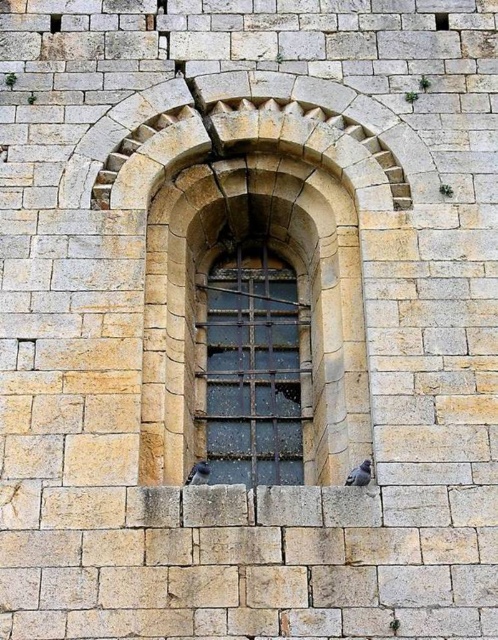
Between point (352, 474) and point (200, 470), which one is positioned in front?

Point (200, 470) is in front.

Is gray matte pigeon at lower right behind gray matte pigeon at lower center?

No, it is in front of gray matte pigeon at lower center.

Find the location of a particular element. gray matte pigeon at lower right is located at coordinates (360, 474).

Between dark glass window at center and gray matte pigeon at lower center, which one has more height?

dark glass window at center

How much distance is there between dark glass window at center and gray matte pigeon at lower center?

A distance of 21.92 feet exists between dark glass window at center and gray matte pigeon at lower center.

Locate an element on the screen. Image resolution: width=498 pixels, height=640 pixels. dark glass window at center is located at coordinates (252, 371).

What are the coordinates of `dark glass window at center` in the screenshot? It's located at (252, 371).

Does point (287, 424) come in front of point (348, 477)?

That is False.

Find the location of a particular element. The width and height of the screenshot is (498, 640). dark glass window at center is located at coordinates (252, 371).